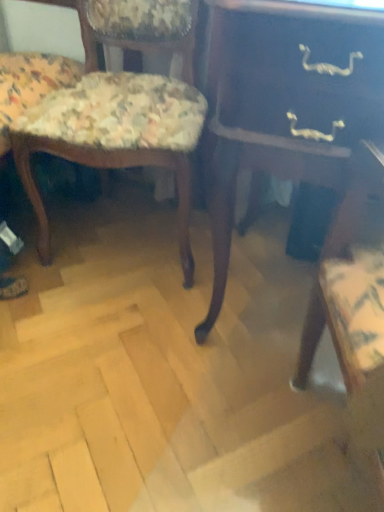
Question: Is floral fabric chair at left, the 2th chair positioned from the left, not within floral fabric chair at left, the second chair in the right-to-left sequence?

Choices:
 (A) yes
 (B) no

Answer: (A)

Question: From the image's perspective, is floral fabric chair at left, acting as the 1th chair starting from the right, above floral fabric chair at left, the second chair in the right-to-left sequence?

Choices:
 (A) yes
 (B) no

Answer: (B)

Question: Is floral fabric chair at left, acting as the 1th chair starting from the right, to the left of floral fabric chair at left, which appears as the 1th chair when viewed from the left, from the viewer's perspective?

Choices:
 (A) no
 (B) yes

Answer: (A)

Question: Is floral fabric chair at left, acting as the 1th chair starting from the right, to the right of floral fabric chair at left, which appears as the 1th chair when viewed from the left, from the viewer's perspective?

Choices:
 (A) no
 (B) yes

Answer: (B)

Question: Is floral fabric chair at left, the 2th chair positioned from the left, surrounding floral fabric chair at left, the second chair in the right-to-left sequence?

Choices:
 (A) yes
 (B) no

Answer: (B)

Question: Is floral fabric chair at left, the 2th chair positioned from the left, bigger than floral fabric chair at left, which appears as the 1th chair when viewed from the left?

Choices:
 (A) yes
 (B) no

Answer: (B)

Question: From a real-world perspective, is dark wood table at center over floral fabric chair at left, the 2th chair positioned from the left?

Choices:
 (A) no
 (B) yes

Answer: (B)

Question: Is dark wood table at center not close to floral fabric chair at left, acting as the 1th chair starting from the right?

Choices:
 (A) no
 (B) yes

Answer: (A)

Question: From a real-world perspective, is dark wood table at center positioned under floral fabric chair at left, acting as the 1th chair starting from the right, based on gravity?

Choices:
 (A) no
 (B) yes

Answer: (A)

Question: Is dark wood table at center further to the viewer compared to floral fabric chair at left, the 2th chair positioned from the left?

Choices:
 (A) yes
 (B) no

Answer: (B)

Question: Does dark wood table at center lie in front of floral fabric chair at left, acting as the 1th chair starting from the right?

Choices:
 (A) yes
 (B) no

Answer: (A)

Question: Considering the relative sizes of dark wood table at center and floral fabric chair at left, acting as the 1th chair starting from the right, in the image provided, is dark wood table at center shorter than floral fabric chair at left, acting as the 1th chair starting from the right,?

Choices:
 (A) no
 (B) yes

Answer: (A)

Question: Is floral fabric chair at left, which appears as the 1th chair when viewed from the left, at the back of dark wood table at center?

Choices:
 (A) no
 (B) yes

Answer: (A)